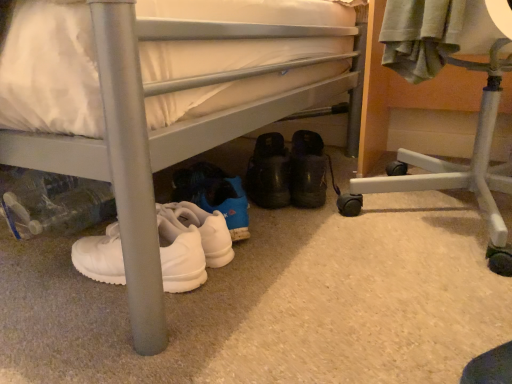
Describe the element at coordinates (307, 170) in the screenshot. I see `black suede shoes at center` at that location.

This screenshot has width=512, height=384. I want to click on black suede shoes at center, so click(x=307, y=170).

Identify the location of black suede shoes at center. (307, 170).

Is white plastic chair at lower right inside or outside of black suede shoes at center?

white plastic chair at lower right is located beyond the bounds of black suede shoes at center.

Consider the image. Which is further, [497,12] or [298,152]?

Positioned behind is point [298,152].

Based on their positions, is white plastic chair at lower right located to the left or right of black suede shoes at center?

From the image, it's evident that white plastic chair at lower right is to the right of black suede shoes at center.

Based on their positions, is black suede shoes at center located to the left or right of white plastic chair at lower right?

From the image, it's evident that black suede shoes at center is to the left of white plastic chair at lower right.

The image size is (512, 384). I want to click on footwear on the left side of white plastic chair at lower right, so click(307, 170).

Does point (320, 178) lie behind point (360, 178)?

No, (320, 178) is in front of (360, 178).

How many degrees apart are the facing directions of black suede shoes at center and white plastic chair at lower right?

119 degrees separate the facing orientations of black suede shoes at center and white plastic chair at lower right.

Is white matte sneakers at lower left taller than black suede shoes at center?

Yes.

Which object is wider, white matte sneakers at lower left or black suede shoes at center?

Wider between the two is white matte sneakers at lower left.

Can black suede shoes at center be found inside white matte sneakers at lower left?

Indeed, black suede shoes at center is located within white matte sneakers at lower left.

From the image's perspective, which one is positioned higher, white matte sneakers at lower left or black suede shoes at center?

white matte sneakers at lower left, from the image's perspective.

Is point (322, 179) closer to camera compared to point (219, 118)?

That is False.

Is black suede shoes at center not close to white matte sneakers at lower left?

No.

Image resolution: width=512 pixels, height=384 pixels. I want to click on footwear below the white matte sneakers at lower left (from the image's perspective), so click(307, 170).

Is white matte sneakers at lower left located within black suede shoes at center?

Actually, white matte sneakers at lower left is outside black suede shoes at center.

Is the surface of white plastic chair at lower right in direct contact with white matte sneakers at lower left?

There is a gap between white plastic chair at lower right and white matte sneakers at lower left.

From a real-world perspective, which is physically above, white plastic chair at lower right or white matte sneakers at lower left?

In real-world perspective, white matte sneakers at lower left is above.

Is white plastic chair at lower right to the left of white matte sneakers at lower left from the viewer's perspective?

No, white plastic chair at lower right is not to the left of white matte sneakers at lower left.

Which of these two, white plastic chair at lower right or white matte sneakers at lower left, is wider?

Wider between the two is white matte sneakers at lower left.

At what (x,y) coordinates should I click in order to perform the action: click on bed in front of the white plastic chair at lower right. Please return your answer as a coordinate pair (x, y). The height and width of the screenshot is (384, 512). Looking at the image, I should click on (160, 134).

Is white matte sneakers at lower left oriented away from white plastic chair at lower right?

That's not correct — white matte sneakers at lower left is not looking away from white plastic chair at lower right.

What's the angular difference between white matte sneakers at lower left and white plastic chair at lower right's facing directions?

They differ by 49.2 degrees in their facing directions.

Does white matte sneakers at lower left contain white plastic chair at lower right?

No.

This screenshot has height=384, width=512. I want to click on furniture located in front of the black suede shoes at center, so click(x=480, y=105).

Where is `footwear located below the white plastic chair at lower right (from the image's perspective)`? The image size is (512, 384). footwear located below the white plastic chair at lower right (from the image's perspective) is located at coordinates (307, 170).

Based on their spatial positions, is white matte sneakers at lower left or white plastic chair at lower right further from black suede shoes at center?

The object further to black suede shoes at center is white matte sneakers at lower left.

Based on their spatial positions, is white matte sneakers at lower left or black suede shoes at center closer to white plastic chair at lower right?

Among the two, black suede shoes at center is located nearer to white plastic chair at lower right.

Considering their positions, is white plastic chair at lower right positioned further to black suede shoes at center than white matte sneakers at lower left?

The object further to black suede shoes at center is white matte sneakers at lower left.

Considering their positions, is black suede shoes at center positioned further to white plastic chair at lower right than white matte sneakers at lower left?

Based on the image, white matte sneakers at lower left appears to be further to white plastic chair at lower right.

Estimate the real-world distances between objects in this image. Which object is further from white matte sneakers at lower left, black suede shoes at center or white plastic chair at lower right?

white plastic chair at lower right lies further to white matte sneakers at lower left than the other object.

Looking at the image, which one is located further to white matte sneakers at lower left, white plastic chair at lower right or black suede shoes at center?

white plastic chair at lower right lies further to white matte sneakers at lower left than the other object.

I want to click on footwear between white matte sneakers at lower left and white plastic chair at lower right from left to right, so [x=307, y=170].